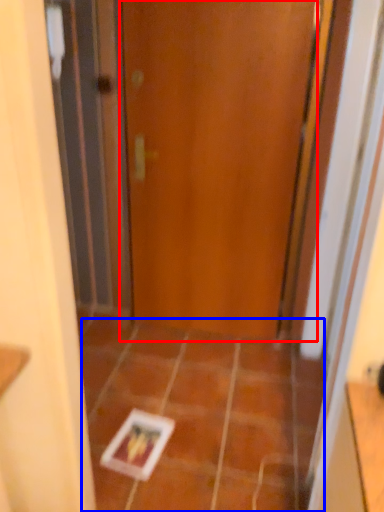
Question: Which point is further to the camera, door (highlighted by a red box) or ceramic tile (highlighted by a blue box)?

Choices:
 (A) door
 (B) ceramic tile

Answer: (A)